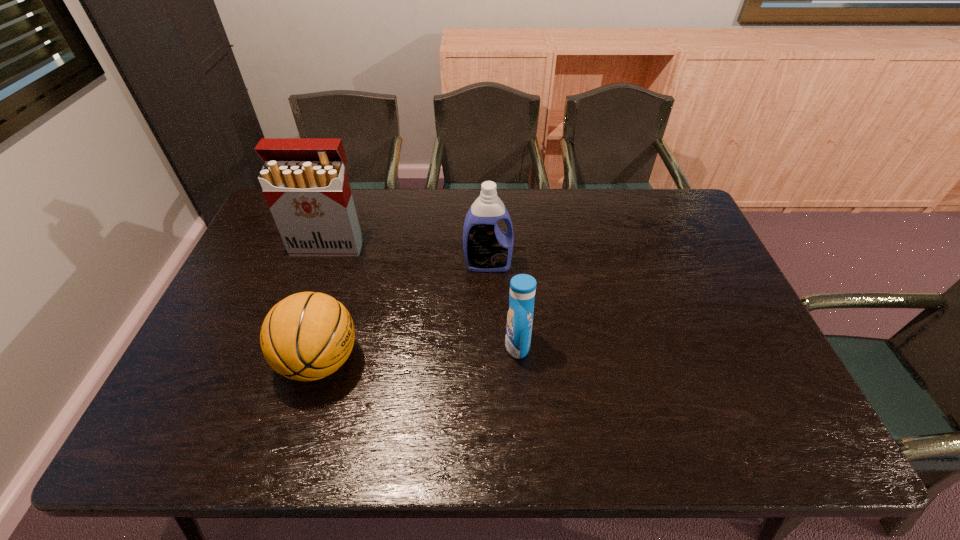
Identify the location of cigarette case. (304, 180).

Find the location of a particular element. Image resolution: width=960 pixels, height=540 pixels. the farther detergent is located at coordinates (487, 248).

Image resolution: width=960 pixels, height=540 pixels. Identify the location of the taller detergent. (487, 248).

Identify the location of the shorter detergent. The width and height of the screenshot is (960, 540). (522, 286).

You are a GUI agent. You are given a task and a screenshot of the screen. Output one action in this format:
    pyautogui.click(x=<x>, y=<y>)
    Task: Click on the basketball
    This screenshot has height=540, width=960.
    Given the screenshot: What is the action you would take?
    pyautogui.click(x=307, y=336)

Find the location of `free location located 0.260m with the lid open on the cigarette case`. free location located 0.260m with the lid open on the cigarette case is located at coordinates (300, 322).

Find the location of a particular element. The height and width of the screenshot is (540, 960). vacant space located on the left of the farther detergent is located at coordinates (418, 264).

Find the location of a particular element. The image size is (960, 540). vacant space situated 0.370m on the front-facing side of the nearer detergent is located at coordinates pos(362,345).

This screenshot has width=960, height=540. I want to click on vacant space located 0.370m on the front-facing side of the nearer detergent, so 362,345.

Locate an element on the screen. The height and width of the screenshot is (540, 960). vacant region located 0.050m on the front-facing side of the nearer detergent is located at coordinates (486, 345).